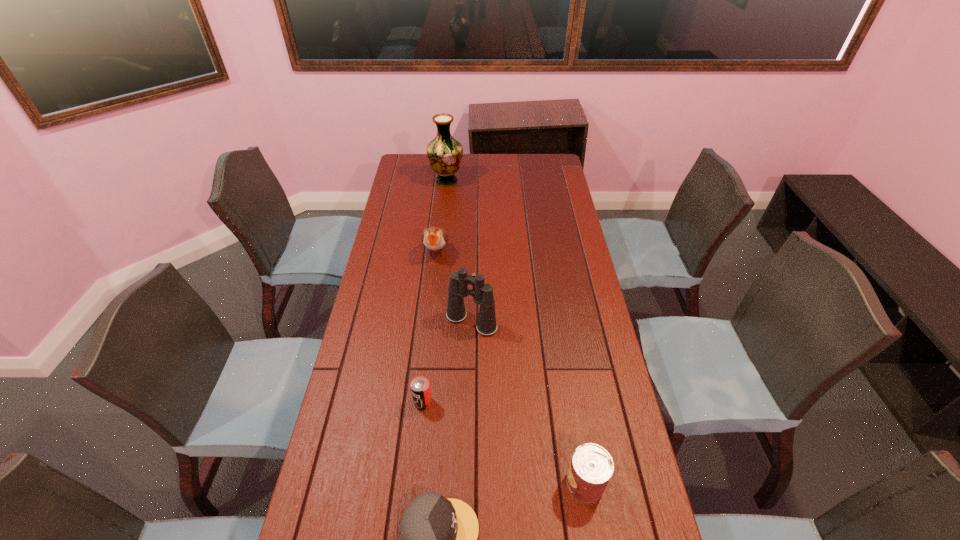
Identify the location of free spot between the vase and the fourth shortest object. The image size is (960, 540). (x=442, y=216).

Identify which object is the third closest to the fourth farthest object. Please provide its 2D coordinates. Your answer should be formatted as a tuple, i.e. [(x, y)], where the tuple contains the x and y coordinates of a point satisfying the conditions above.

[(591, 467)]

At what (x,y) coordinates should I click in order to perform the action: click on object that can be found as the closest to the vase. Please return your answer as a coordinate pair (x, y). The height and width of the screenshot is (540, 960). Looking at the image, I should click on (434, 238).

Find the location of `free space that satisfies the following two spatial constraints: 1. at the face of the fifth nearest object; 2. on the right side of the left can`. free space that satisfies the following two spatial constraints: 1. at the face of the fifth nearest object; 2. on the right side of the left can is located at coordinates (420, 402).

Locate an element on the screen. The image size is (960, 540). vacant space that satisfies the following two spatial constraints: 1. at the face of the binoculars; 2. on the right side of the bird is located at coordinates (428, 322).

This screenshot has height=540, width=960. Identify the location of vacant space that satisfies the following two spatial constraints: 1. on the front side of the taller can; 2. on the left side of the farther can. (415, 483).

Identify the location of blank area in the image that satisfies the following two spatial constraints: 1. at the face of the fifth shortest object; 2. on the right side of the fifth nearest object. The image size is (960, 540). (428, 322).